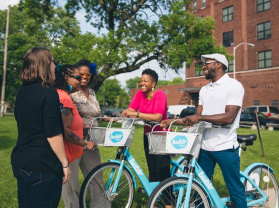
I want to click on seat, so click(x=251, y=137).